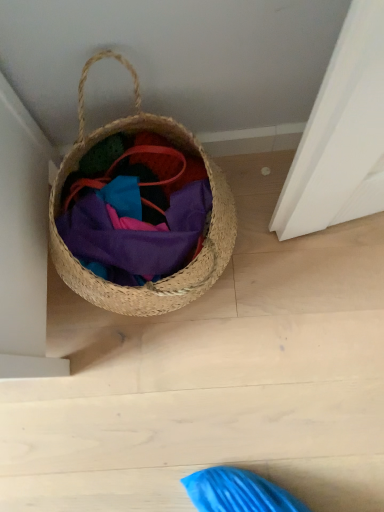
Question: Is woven straw basket at left situated inside matte woven basket at center or outside?

Choices:
 (A) inside
 (B) outside

Answer: (B)

Question: From the image's perspective, is woven straw basket at left above or below matte woven basket at center?

Choices:
 (A) above
 (B) below

Answer: (A)

Question: Considering the positions of woven straw basket at left and matte woven basket at center in the image, is woven straw basket at left wider or thinner than matte woven basket at center?

Choices:
 (A) thin
 (B) wide

Answer: (B)

Question: Considering the relative positions of matte woven basket at center and woven straw basket at left in the image provided, is matte woven basket at center to the left or to the right of woven straw basket at left?

Choices:
 (A) left
 (B) right

Answer: (B)

Question: From the image's perspective, is matte woven basket at center positioned above or below woven straw basket at left?

Choices:
 (A) below
 (B) above

Answer: (A)

Question: Looking at the image, does matte woven basket at center seem bigger or smaller compared to woven straw basket at left?

Choices:
 (A) small
 (B) big

Answer: (A)

Question: Looking at their shapes, would you say matte woven basket at center is wider or thinner than woven straw basket at left?

Choices:
 (A) thin
 (B) wide

Answer: (A)